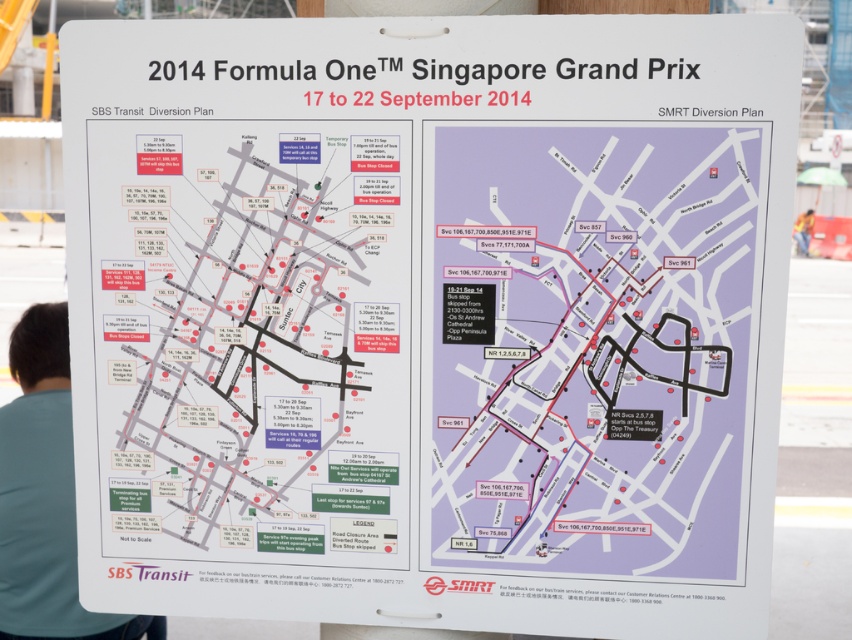
You are looking at the map of the Singapore Grand Prix transit diversion plan. There are two points marked on the map at coordinates point (653, 420) and point (61, 465). Which point is closer to you as you view the map?

Point (653, 420) is closer to the camera than point (61, 465).

You are holding a purple paper map at center and a blue fabric shirt at lower left. Which item is closer to you?

The purple paper map at center is closer to you because it is in front of the blue fabric shirt at lower left.